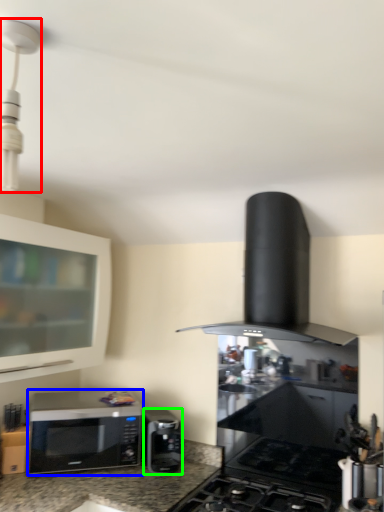
Question: Based on their relative distances, which object is nearer to light fixture (highlighted by a red box)? Choose from microwave oven (highlighted by a blue box) and microwave oven (highlighted by a green box).

Choices:
 (A) microwave oven
 (B) microwave oven

Answer: (A)